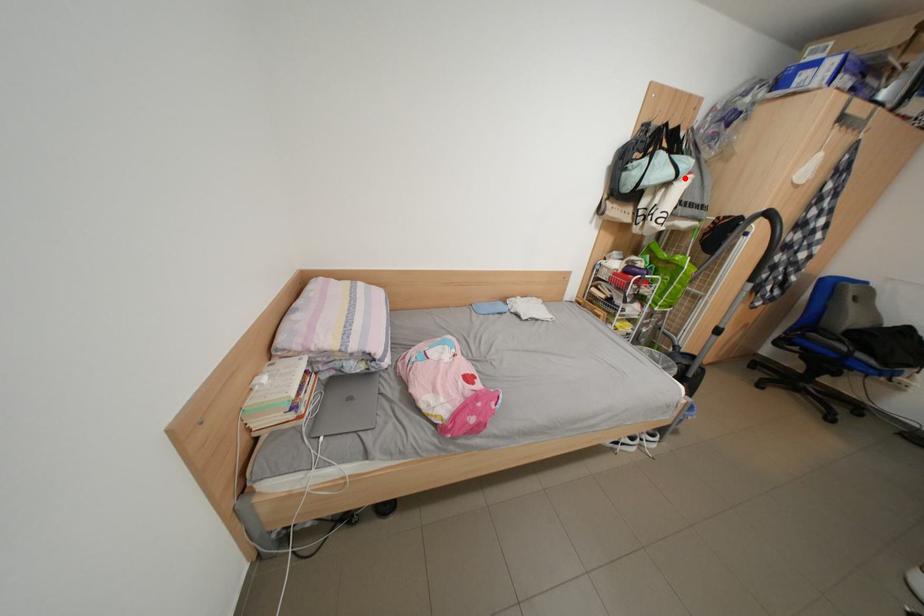
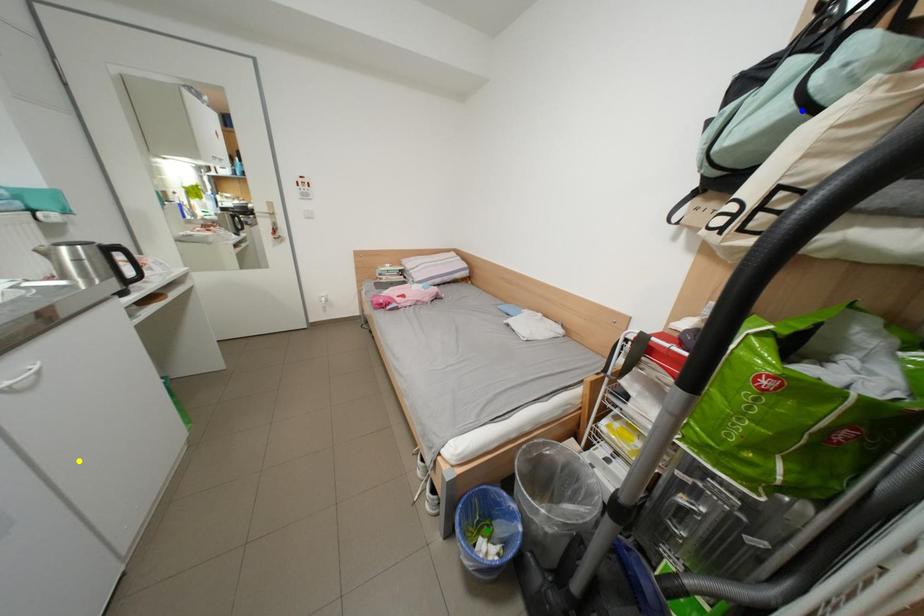
Question: I am providing you with two images of the same scene from different viewpoints. A red point is marked on the first image. You are given multiple points on the second image. Which point in image 2 is actually the same real-world point as the red point in image 1?

Choices:
 (A) green point
 (B) yellow point
 (C) blue point

Answer: (C)